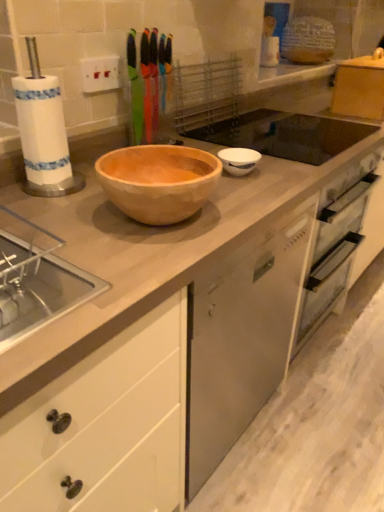
At what (x,y) coordinates should I click in order to perform the action: click on black glass sink at upper center. Please return your answer as a coordinate pair (x, y). Looking at the image, I should click on (285, 135).

The height and width of the screenshot is (512, 384). Describe the element at coordinates (285, 135) in the screenshot. I see `black glass sink at upper center` at that location.

Where is `white glossy bowl at center`? This screenshot has height=512, width=384. white glossy bowl at center is located at coordinates (239, 160).

The height and width of the screenshot is (512, 384). What do you see at coordinates (239, 160) in the screenshot?
I see `white glossy bowl at center` at bounding box center [239, 160].

The height and width of the screenshot is (512, 384). Find the location of `black glass sink at upper center`. black glass sink at upper center is located at coordinates (285, 135).

Does black glass sink at upper center appear on the right side of white glossy bowl at center?

Yes, black glass sink at upper center is to the right of white glossy bowl at center.

Is black glass sink at upper center in front of white glossy bowl at center?

No, black glass sink at upper center is further to the viewer.

Is point (309, 154) more distant than point (250, 170)?

Yes, it is behind point (250, 170).

In the scene shown: From the image's perspective, which is below, black glass sink at upper center or white glossy bowl at center?

white glossy bowl at center appears lower in the image.

Looking at this image, from a real-world perspective, between black glass sink at upper center and white glossy bowl at center, who is vertically higher?

white glossy bowl at center is physically above.

Can you confirm if black glass sink at upper center is thinner than white glossy bowl at center?

In fact, black glass sink at upper center might be wider than white glossy bowl at center.

Is black glass sink at upper center taller or shorter than white glossy bowl at center?

In the image, black glass sink at upper center appears to be shorter than white glossy bowl at center.

Considering the relative sizes of black glass sink at upper center and white glossy bowl at center in the image provided, is black glass sink at upper center bigger than white glossy bowl at center?

Indeed, black glass sink at upper center has a larger size compared to white glossy bowl at center.

Is black glass sink at upper center not within white glossy bowl at center?

black glass sink at upper center is positioned outside white glossy bowl at center.

Are black glass sink at upper center and white glossy bowl at center located far from each other?

No, black glass sink at upper center is not far from white glossy bowl at center.

Is black glass sink at upper center oriented towards white glossy bowl at center?

No.

Looking at this image, how many degrees apart are the facing directions of black glass sink at upper center and white glossy bowl at center?

The angle between the facing direction of black glass sink at upper center and the facing direction of white glossy bowl at center is 0.203 degrees.

How distant is black glass sink at upper center from white glossy bowl at center?

A distance of 16.76 inches exists between black glass sink at upper center and white glossy bowl at center.

Where is `sink that appears above the white glossy bowl at center (from the image's perspective)`? This screenshot has height=512, width=384. sink that appears above the white glossy bowl at center (from the image's perspective) is located at coordinates (285, 135).

Which object is positioned more to the left, white glossy bowl at center or black glass sink at upper center?

Positioned to the left is white glossy bowl at center.

Which object is further away from the camera taking this photo, white glossy bowl at center or black glass sink at upper center?

black glass sink at upper center is more distant.

Is point (230, 159) farther from camera compared to point (345, 144)?

No.

From the image's perspective, which is above, white glossy bowl at center or black glass sink at upper center?

black glass sink at upper center is shown above in the image.

From a real-world perspective, between white glossy bowl at center and black glass sink at upper center, who is vertically lower?

black glass sink at upper center is physically lower.

Is white glossy bowl at center thinner than black glass sink at upper center?

Yes.

Can you confirm if white glossy bowl at center is taller than black glass sink at upper center?

Yes, white glossy bowl at center is taller than black glass sink at upper center.

Can you confirm if white glossy bowl at center is smaller than black glass sink at upper center?

Yes.

Could black glass sink at upper center be considered to be inside white glossy bowl at center?

Actually, black glass sink at upper center is outside white glossy bowl at center.

Is white glossy bowl at center next to black glass sink at upper center?

white glossy bowl at center is not next to black glass sink at upper center, and they're not touching.

Is white glossy bowl at center facing towards black glass sink at upper center?

No, white glossy bowl at center does not turn towards black glass sink at upper center.

Can you tell me how much white glossy bowl at center and black glass sink at upper center differ in facing direction?

0.203 degrees.

From the picture: How far apart are white glossy bowl at center and black glass sink at upper center?

16.76 inches.

Locate an element on the screen. The height and width of the screenshot is (512, 384). sink below the white glossy bowl at center (from a real-world perspective) is located at coordinates (285, 135).

In order to click on sink above the white glossy bowl at center (from the image's perspective) in this screenshot , I will do `click(285, 135)`.

You are a GUI agent. You are given a task and a screenshot of the screen. Output one action in this format:
    pyautogui.click(x=<x>, y=<y>)
    Task: Click on the sink on the right side of white glossy bowl at center
    Image resolution: width=384 pixels, height=512 pixels.
    Given the screenshot: What is the action you would take?
    pyautogui.click(x=285, y=135)